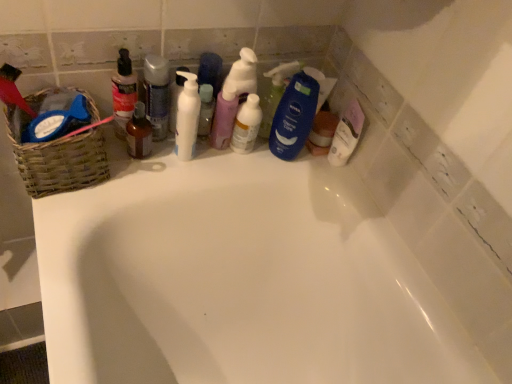
Image resolution: width=512 pixels, height=384 pixels. Identify the location of free space to the right of translucent plastic spray bottle at center, which is counted as the third cleaning product, starting from the left. (298, 165).